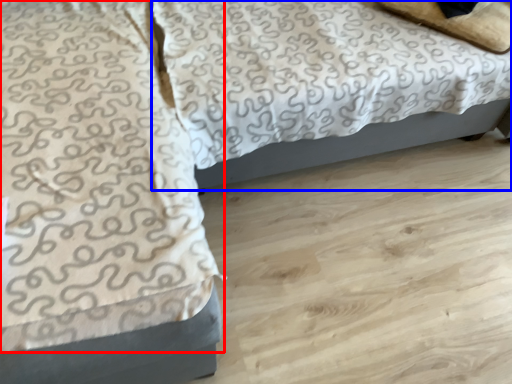
Question: Among these objects, which one is nearest to the camera, blanket (highlighted by a red box) or bed (highlighted by a blue box)?

Choices:
 (A) blanket
 (B) bed

Answer: (A)